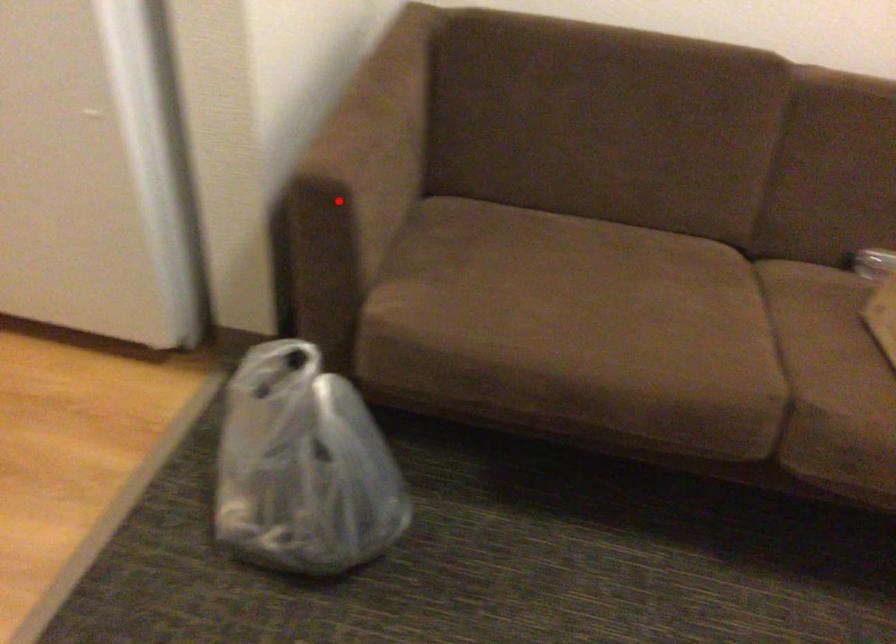
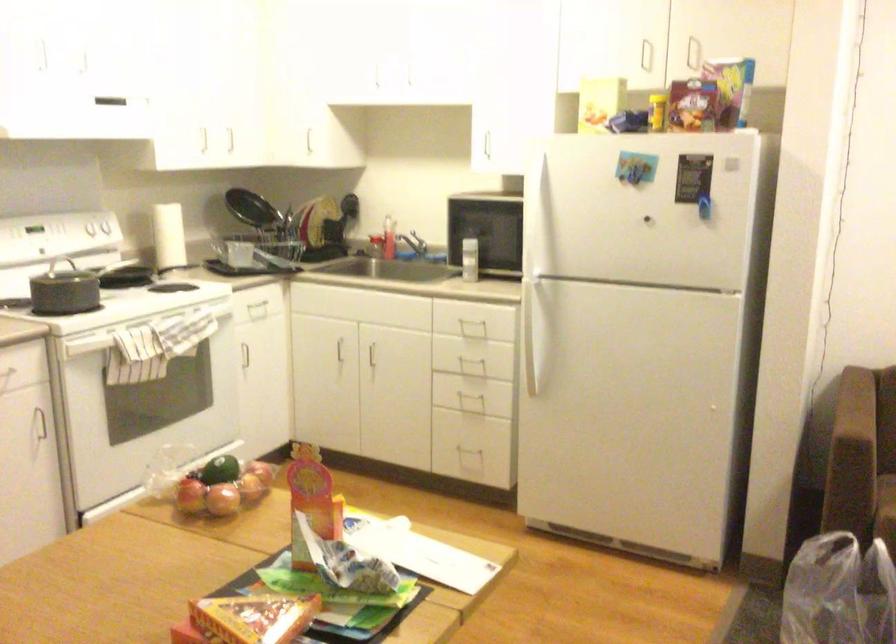
Where in the second image is the point corresponding to the highlighted location from the first image?

(879, 446)